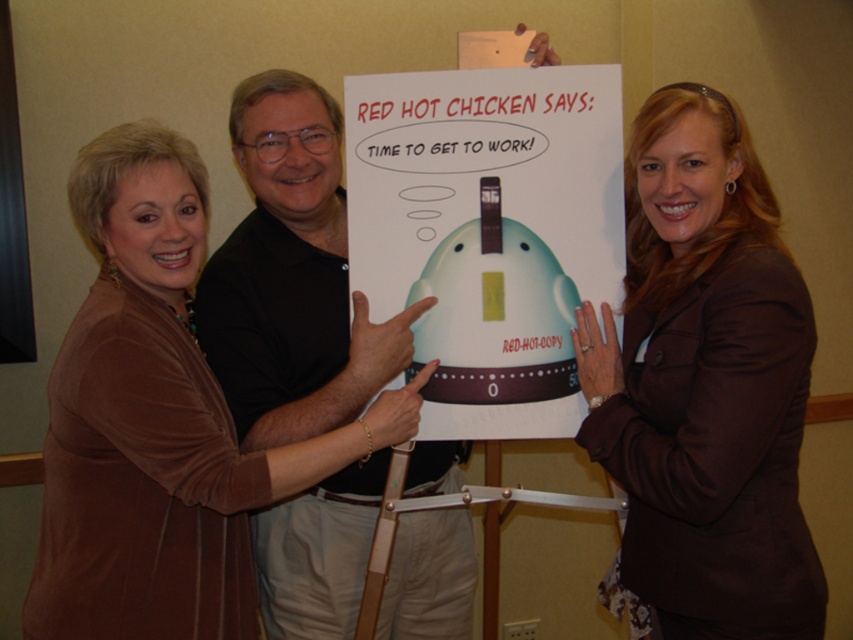
You are a photographer at the event and need to adjust the lighting so that both the brown fabric jacket at upper right and the brown velvety sweater at upper left are equally visible. Which object is currently blocking the light from reaching the other?

The brown fabric jacket at upper right is positioned over the brown velvety sweater at upper left, so it is blocking the light from reaching the sweater.

You are a photographer adjusting your camera settings to focus on two points in the image. The first point is point [84,577] and the second is point [485,438]. Which point should you focus on first if you want to ensure the closest object is sharp?

Point [84,577] is closer to the camera than point [485,438], so you should focus on point [84,577] first to ensure the closest object is sharp.

You are a photographer at the event and need to adjust lighting to highlight both the brown fabric jacket at upper right and the brown velvety sweater at upper left. Since one of them is smaller, which one requires more precise focus to ensure details are captured clearly?

The brown fabric jacket at upper right requires more precise focus because it occupies less space than the brown velvety sweater at upper left, making its details harder to capture clearly in the photo.